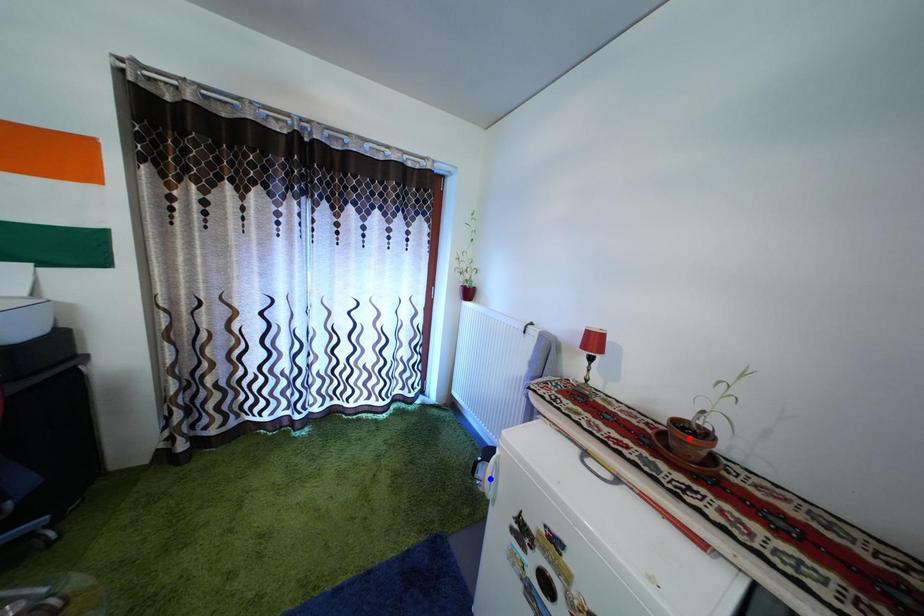
Question: Which of the two points in the image is closer to the camera?

Choices:
 (A) Blue point is closer.
 (B) Red point is closer.

Answer: (B)